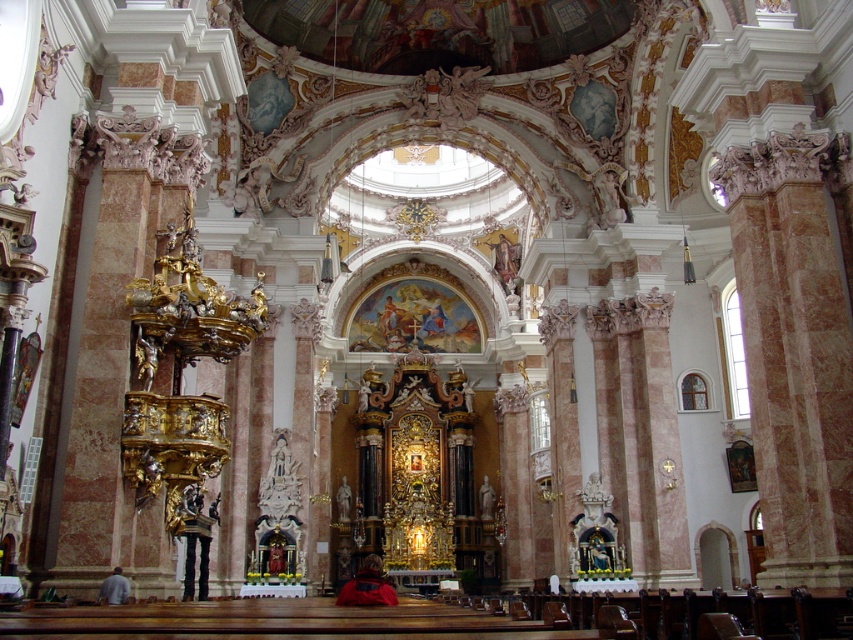
Question: Can you confirm if red jacket at center is bigger than gray fabric jacket at lower left?

Choices:
 (A) no
 (B) yes

Answer: (B)

Question: Which object is farther from the camera taking this photo?

Choices:
 (A) red jacket at center
 (B) gray fabric jacket at lower left

Answer: (A)

Question: Which point is farther from the camera taking this photo?

Choices:
 (A) (364, 570)
 (B) (113, 592)

Answer: (A)

Question: Is red jacket at center bigger than gray fabric jacket at lower left?

Choices:
 (A) no
 (B) yes

Answer: (B)

Question: Which of the following is the farthest from the observer?

Choices:
 (A) (113, 582)
 (B) (358, 573)

Answer: (B)

Question: Does red jacket at center come behind gray fabric jacket at lower left?

Choices:
 (A) yes
 (B) no

Answer: (A)